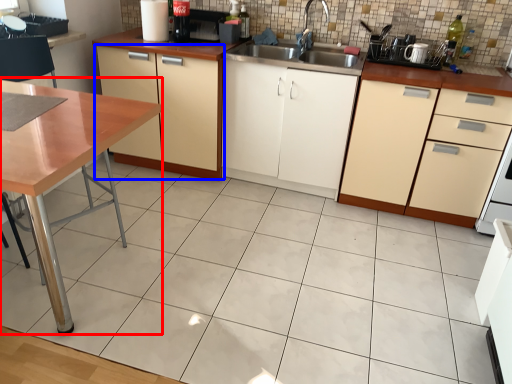
Question: Which of the following is the closest to the observer, table (highlighted by a red box) or cabinetry (highlighted by a blue box)?

Choices:
 (A) table
 (B) cabinetry

Answer: (A)